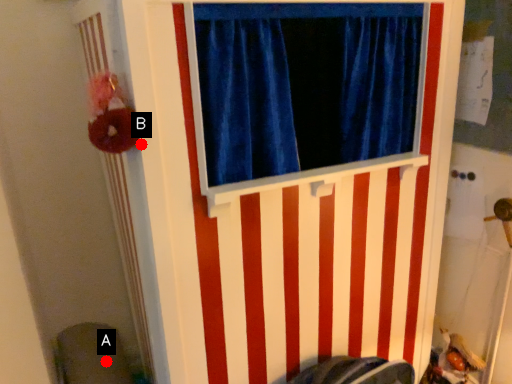
Question: Two points are circled on the image, labeled by A and B beside each circle. Which point is closer to the camera?

Choices:
 (A) A is closer
 (B) B is closer

Answer: (B)